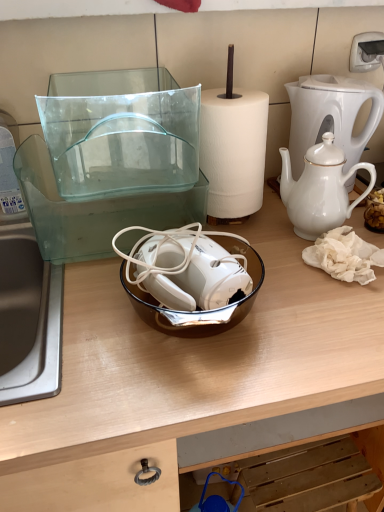
The image size is (384, 512). I want to click on vacant space situated above white glossy coffee maker at upper right (from a real-world perspective), so click(x=331, y=78).